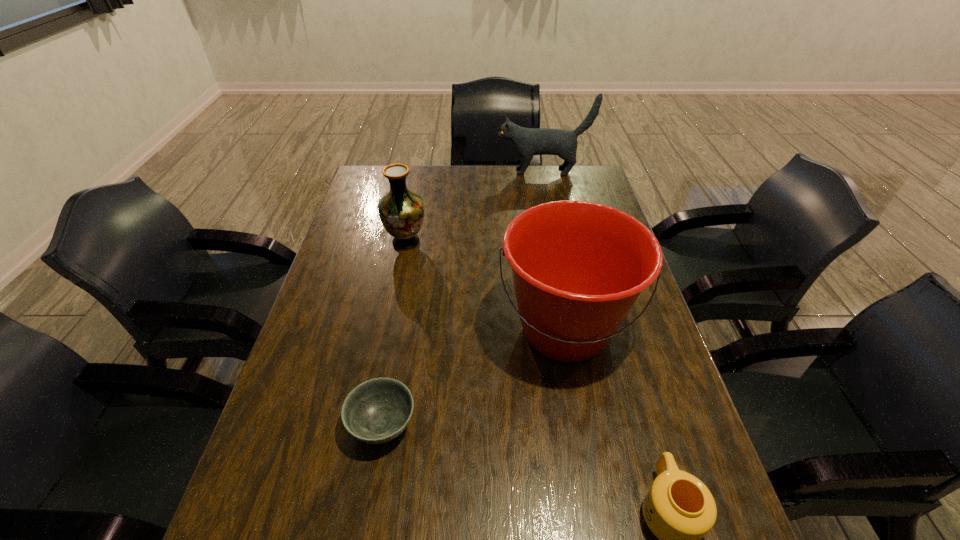
This screenshot has height=540, width=960. I want to click on vacant space located on the right of the fourth farthest object, so click(463, 424).

The image size is (960, 540). What are the coordinates of `object situated at the far edge` in the screenshot? It's located at (527, 142).

Locate an element on the screen. object that is positioned at the left edge is located at coordinates (401, 211).

At what (x,y) coordinates should I click in order to perform the action: click on cat present at the right edge. Please return your answer as a coordinate pair (x, y). Looking at the image, I should click on (527, 142).

Locate an element on the screen. The width and height of the screenshot is (960, 540). bucket positioned at the right edge is located at coordinates (578, 267).

Where is `object at the far right corner`? Image resolution: width=960 pixels, height=540 pixels. object at the far right corner is located at coordinates (527, 142).

Where is `vacant point at the far edge`? The height and width of the screenshot is (540, 960). vacant point at the far edge is located at coordinates (549, 177).

Locate an element on the screen. The image size is (960, 540). free region at the left edge is located at coordinates (296, 519).

Find the location of `vacant space at the right edge of the desktop`. vacant space at the right edge of the desktop is located at coordinates (639, 390).

In the image, there is a desktop. Where is `free region at the far left corner`? The width and height of the screenshot is (960, 540). free region at the far left corner is located at coordinates pyautogui.click(x=371, y=178).